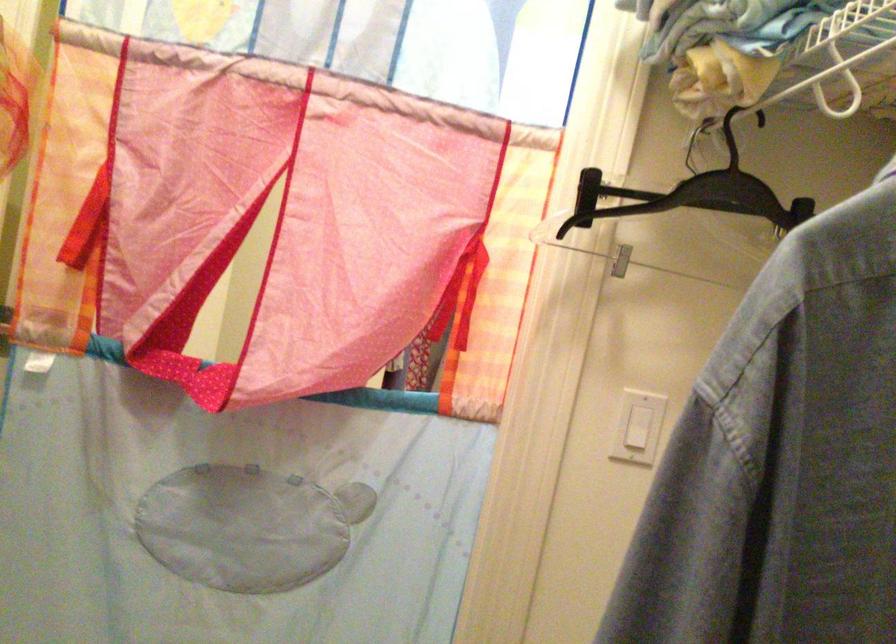
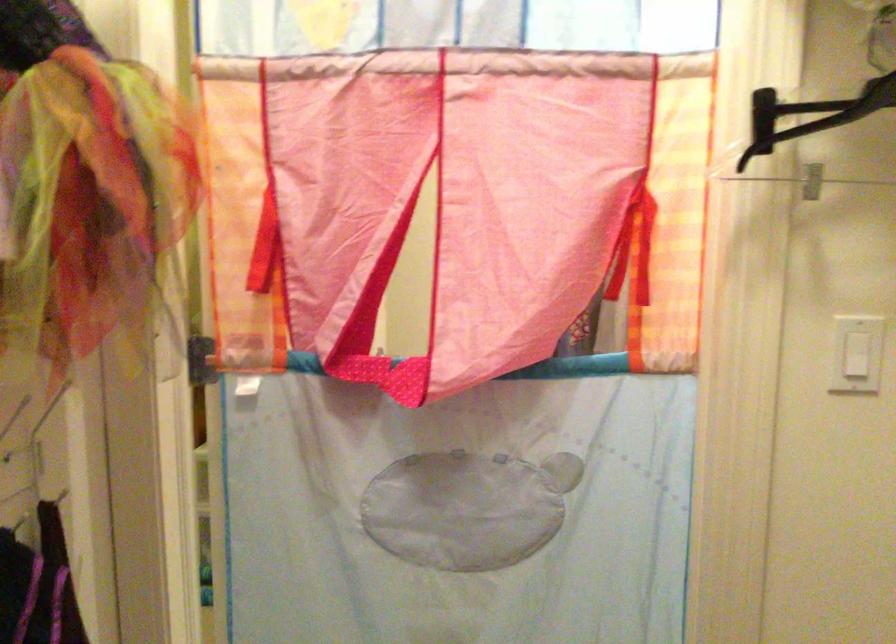
Question: What movement of the cameraman would produce the second image?

Choices:
 (A) Left
 (B) Right
 (C) Forward
 (D) Backward

Answer: (A)